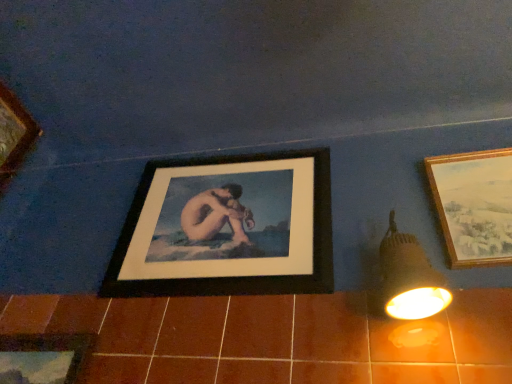
Measure the distance between point (161, 347) and camera.

36.50 inches.

You are a GUI agent. You are given a task and a screenshot of the screen. Output one action in this format:
    pyautogui.click(x=<x>, y=<y>)
    Task: Click on the matte black light fixture at right
    
    Given the screenshot: What is the action you would take?
    coord(409,289)

This screenshot has width=512, height=384. Find the location of `wooden picture frame at lower left, which is the 1th picture frame in left-to-right order`. wooden picture frame at lower left, which is the 1th picture frame in left-to-right order is located at coordinates (42, 358).

Image resolution: width=512 pixels, height=384 pixels. Describe the element at coordinates (228, 228) in the screenshot. I see `black matte picture frame at center, the 2th picture frame viewed from the left` at that location.

Locate an element on the screen. The width and height of the screenshot is (512, 384). brown ceramic tile at lower center is located at coordinates [272, 339].

Is brown ceramic tile at lower center taller than wooden framed landscape painting at right, placed as the 1th picture frame when sorted from right to left?

In fact, brown ceramic tile at lower center may be shorter than wooden framed landscape painting at right, placed as the 1th picture frame when sorted from right to left.

Is brown ceramic tile at lower center facing away from wooden framed landscape painting at right, which appears as the 3th picture frame when viewed from the left?

No, brown ceramic tile at lower center is not facing the opposite direction of wooden framed landscape painting at right, which appears as the 3th picture frame when viewed from the left.

From the picture: From a real-world perspective, is brown ceramic tile at lower center above or below wooden framed landscape painting at right, placed as the 1th picture frame when sorted from right to left?

brown ceramic tile at lower center is below wooden framed landscape painting at right, placed as the 1th picture frame when sorted from right to left.

Considering the relative sizes of brown ceramic tile at lower center and wooden framed landscape painting at right, which appears as the 3th picture frame when viewed from the left, in the image provided, is brown ceramic tile at lower center wider than wooden framed landscape painting at right, which appears as the 3th picture frame when viewed from the left,?

No, brown ceramic tile at lower center is not wider than wooden framed landscape painting at right, which appears as the 3th picture frame when viewed from the left.

Is black matte picture frame at center, the 2th picture frame viewed from the left, completely or partially outside of wooden picture frame at lower left, which is the 1th picture frame in left-to-right order?

Yes, black matte picture frame at center, the 2th picture frame viewed from the left, is outside of wooden picture frame at lower left, which is the 1th picture frame in left-to-right order.

In the scene shown: Which is more to the left, black matte picture frame at center, marked as the second picture frame in a right-to-left arrangement, or wooden picture frame at lower left, which is the 1th picture frame in left-to-right order?

wooden picture frame at lower left, which is the 1th picture frame in left-to-right order.

Is black matte picture frame at center, the 2th picture frame viewed from the left, oriented towards wooden picture frame at lower left, which is the 1th picture frame in left-to-right order?

No, black matte picture frame at center, the 2th picture frame viewed from the left, is not aimed at wooden picture frame at lower left, which is the 1th picture frame in left-to-right order.

Considering the relative sizes of black matte picture frame at center, the 2th picture frame viewed from the left, and wooden picture frame at lower left, which is the 1th picture frame in left-to-right order, in the image provided, is black matte picture frame at center, the 2th picture frame viewed from the left, bigger than wooden picture frame at lower left, which is the 1th picture frame in left-to-right order,?

Indeed, black matte picture frame at center, the 2th picture frame viewed from the left, has a larger size compared to wooden picture frame at lower left, which is the 1th picture frame in left-to-right order.

From the image's perspective, does wooden picture frame at lower left, which is the 1th picture frame in left-to-right order, appear lower than black matte picture frame at center, marked as the second picture frame in a right-to-left arrangement?

Yes.

Looking at this image, considering the relative sizes of wooden picture frame at lower left, the 3th picture frame from the right, and black matte picture frame at center, marked as the second picture frame in a right-to-left arrangement, in the image provided, is wooden picture frame at lower left, the 3th picture frame from the right, smaller than black matte picture frame at center, marked as the second picture frame in a right-to-left arrangement,?

Yes.

Considering the relative sizes of wooden picture frame at lower left, the 3th picture frame from the right, and black matte picture frame at center, the 2th picture frame viewed from the left, in the image provided, is wooden picture frame at lower left, the 3th picture frame from the right, thinner than black matte picture frame at center, the 2th picture frame viewed from the left,?

Yes, wooden picture frame at lower left, the 3th picture frame from the right, is thinner than black matte picture frame at center, the 2th picture frame viewed from the left.

Is matte black light fixture at right positioned with its back to wooden framed landscape painting at right, placed as the 1th picture frame when sorted from right to left?

matte black light fixture at right does not have its back to wooden framed landscape painting at right, placed as the 1th picture frame when sorted from right to left.

Which of these two, matte black light fixture at right or wooden framed landscape painting at right, placed as the 1th picture frame when sorted from right to left, stands taller?

wooden framed landscape painting at right, placed as the 1th picture frame when sorted from right to left, is taller.

Does matte black light fixture at right have a greater width compared to wooden framed landscape painting at right, placed as the 1th picture frame when sorted from right to left?

Yes.

Which object is closer to the camera taking this photo, wooden framed landscape painting at right, which appears as the 3th picture frame when viewed from the left, or brown ceramic tile at lower center?

Positioned in front is brown ceramic tile at lower center.

Considering the sizes of wooden framed landscape painting at right, placed as the 1th picture frame when sorted from right to left, and brown ceramic tile at lower center in the image, is wooden framed landscape painting at right, placed as the 1th picture frame when sorted from right to left, taller or shorter than brown ceramic tile at lower center?

In the image, wooden framed landscape painting at right, placed as the 1th picture frame when sorted from right to left, appears to be taller than brown ceramic tile at lower center.

From a real-world perspective, between wooden framed landscape painting at right, which appears as the 3th picture frame when viewed from the left, and brown ceramic tile at lower center, who is vertically lower?

brown ceramic tile at lower center.

Can you confirm if wooden framed landscape painting at right, which appears as the 3th picture frame when viewed from the left, is smaller than brown ceramic tile at lower center?

Correct, wooden framed landscape painting at right, which appears as the 3th picture frame when viewed from the left, occupies less space than brown ceramic tile at lower center.

Looking at the image, does black matte picture frame at center, marked as the second picture frame in a right-to-left arrangement, seem bigger or smaller compared to wooden framed landscape painting at right, placed as the 1th picture frame when sorted from right to left?

In the image, black matte picture frame at center, marked as the second picture frame in a right-to-left arrangement, appears to be larger than wooden framed landscape painting at right, placed as the 1th picture frame when sorted from right to left.

Is point (112, 272) positioned before point (478, 247)?

No.

From the image's perspective, is black matte picture frame at center, the 2th picture frame viewed from the left, above or below wooden framed landscape painting at right, placed as the 1th picture frame when sorted from right to left?

From the image's perspective, black matte picture frame at center, the 2th picture frame viewed from the left, appears below wooden framed landscape painting at right, placed as the 1th picture frame when sorted from right to left.

Which of these two, black matte picture frame at center, the 2th picture frame viewed from the left, or wooden framed landscape painting at right, which appears as the 3th picture frame when viewed from the left, is thinner?

Thinner between the two is black matte picture frame at center, the 2th picture frame viewed from the left.

Consider the image. Is wooden picture frame at lower left, the 3th picture frame from the right, at the back of brown ceramic tile at lower center?

No, wooden picture frame at lower left, the 3th picture frame from the right, is not at the back of brown ceramic tile at lower center.

Is brown ceramic tile at lower center outside of wooden picture frame at lower left, which is the 1th picture frame in left-to-right order?

Yes, brown ceramic tile at lower center is not within wooden picture frame at lower left, which is the 1th picture frame in left-to-right order.

Is brown ceramic tile at lower center thinner than wooden picture frame at lower left, the 3th picture frame from the right?

In fact, brown ceramic tile at lower center might be wider than wooden picture frame at lower left, the 3th picture frame from the right.

From a real-world perspective, is brown ceramic tile at lower center on top of wooden picture frame at lower left, which is the 1th picture frame in left-to-right order?

Yes.

Which picture frame is the 2nd one when counting from the right side of the brown ceramic tile at lower center? Please provide its 2D coordinates.

[(474, 205)]

At what (x,y) coordinates should I click in order to perform the action: click on the 1st picture frame above the wooden picture frame at lower left, the 3th picture frame from the right (from the image's perspective). Please return your answer as a coordinate pair (x, y). Looking at the image, I should click on (228, 228).

Looking at the image, which one is located closer to wooden picture frame at lower left, which is the 1th picture frame in left-to-right order, matte black light fixture at right or brown ceramic tile at lower center?

Based on the image, brown ceramic tile at lower center appears to be nearer to wooden picture frame at lower left, which is the 1th picture frame in left-to-right order.

Considering their positions, is matte black light fixture at right positioned further to black matte picture frame at center, the 2th picture frame viewed from the left, than wooden framed landscape painting at right, which appears as the 3th picture frame when viewed from the left?

Among the two, wooden framed landscape painting at right, which appears as the 3th picture frame when viewed from the left, is located further to black matte picture frame at center, the 2th picture frame viewed from the left.

Which object lies further to the anchor point wooden framed landscape painting at right, placed as the 1th picture frame when sorted from right to left, matte black light fixture at right or wooden picture frame at lower left, which is the 1th picture frame in left-to-right order?

wooden picture frame at lower left, which is the 1th picture frame in left-to-right order.

Considering their positions, is wooden framed landscape painting at right, placed as the 1th picture frame when sorted from right to left, positioned closer to matte black light fixture at right than brown ceramic tile at lower center?

brown ceramic tile at lower center is positioned closer to the anchor matte black light fixture at right.

Based on their spatial positions, is black matte picture frame at center, the 2th picture frame viewed from the left, or matte black light fixture at right further from brown ceramic tile at lower center?

black matte picture frame at center, the 2th picture frame viewed from the left, is further to brown ceramic tile at lower center.

Looking at the image, which one is located further to brown ceramic tile at lower center, wooden framed landscape painting at right, placed as the 1th picture frame when sorted from right to left, or wooden picture frame at lower left, the 3th picture frame from the right?

The object further to brown ceramic tile at lower center is wooden framed landscape painting at right, placed as the 1th picture frame when sorted from right to left.

Estimate the real-world distances between objects in this image. Which object is closer to wooden framed landscape painting at right, which appears as the 3th picture frame when viewed from the left, brown ceramic tile at lower center or wooden picture frame at lower left, the 3th picture frame from the right?

brown ceramic tile at lower center is closer to wooden framed landscape painting at right, which appears as the 3th picture frame when viewed from the left.

Based on their spatial positions, is matte black light fixture at right or wooden framed landscape painting at right, which appears as the 3th picture frame when viewed from the left, further from wooden picture frame at lower left, the 3th picture frame from the right?

The object further to wooden picture frame at lower left, the 3th picture frame from the right, is wooden framed landscape painting at right, which appears as the 3th picture frame when viewed from the left.

Where is `light fixture between brown ceramic tile at lower center and wooden framed landscape painting at right, which appears as the 3th picture frame when viewed from the left, in the horizontal direction`? light fixture between brown ceramic tile at lower center and wooden framed landscape painting at right, which appears as the 3th picture frame when viewed from the left, in the horizontal direction is located at coordinates (409, 289).

You are a GUI agent. You are given a task and a screenshot of the screen. Output one action in this format:
    pyautogui.click(x=<x>, y=<y>)
    Task: Click on the light fixture between black matte picture frame at center, marked as the second picture frame in a right-to-left arrangement, and wooden framed landscape painting at right, which appears as the 3th picture frame when viewed from the left, from left to right
    The width and height of the screenshot is (512, 384).
    Given the screenshot: What is the action you would take?
    pyautogui.click(x=409, y=289)

Identify the location of picture frame between brown ceramic tile at lower center and wooden framed landscape painting at right, which appears as the 3th picture frame when viewed from the left, from left to right. (228, 228).

Locate an element on the screen. The width and height of the screenshot is (512, 384). ceramic tile situated between wooden picture frame at lower left, the 3th picture frame from the right, and black matte picture frame at center, marked as the second picture frame in a right-to-left arrangement, from left to right is located at coordinates (272, 339).